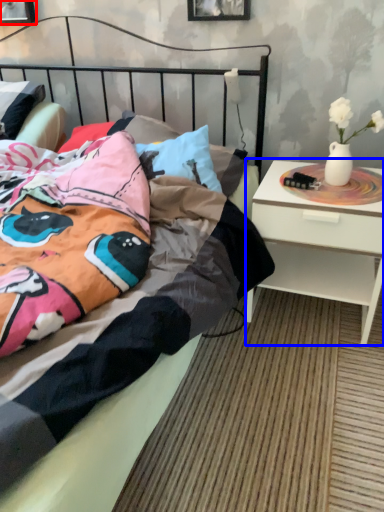
Question: Which point is closer to the camera, picture frame (highlighted by a red box) or nightstand (highlighted by a blue box)?

Choices:
 (A) picture frame
 (B) nightstand

Answer: (B)